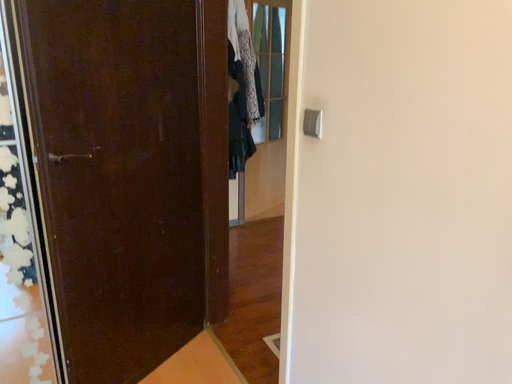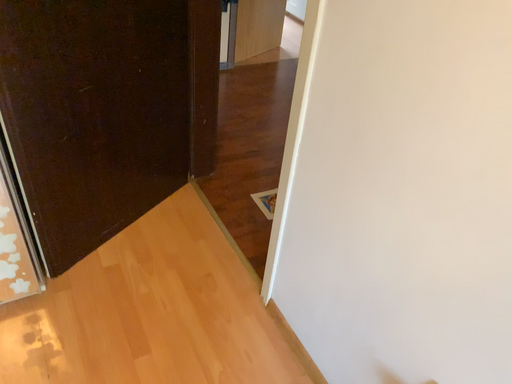
Question: Which way did the camera rotate in the video?

Choices:
 (A) rotated upward
 (B) rotated downward

Answer: (B)